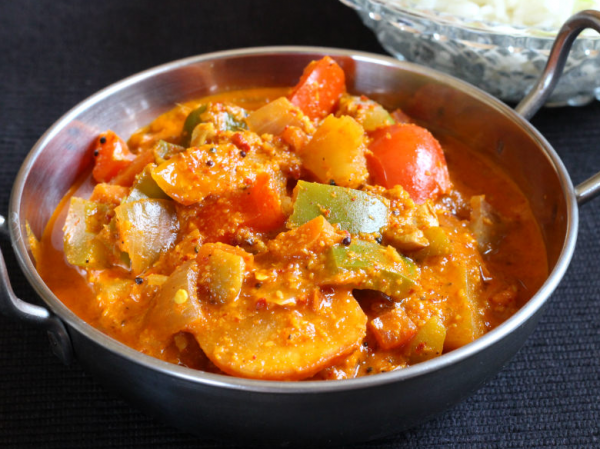
Identify the location of glass bowl. [x=503, y=52].